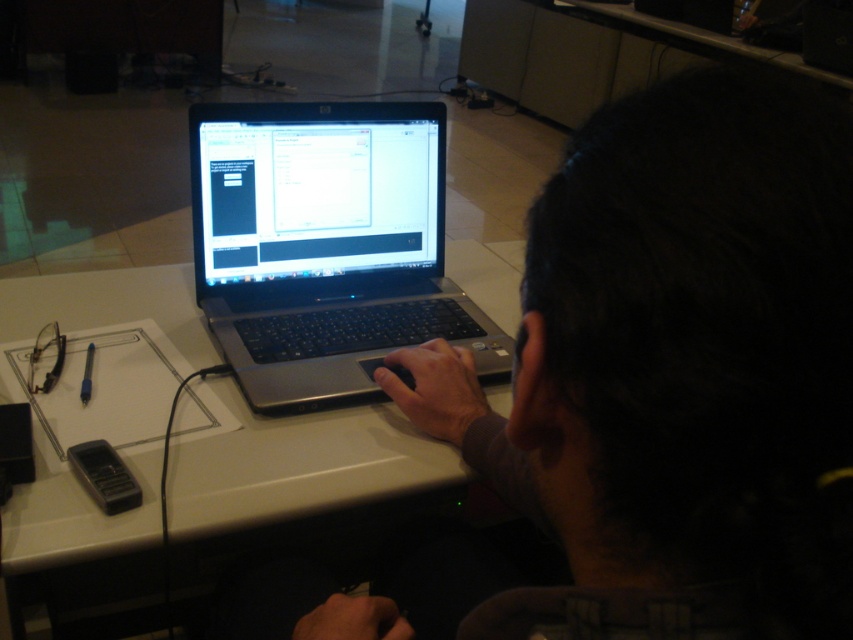
You are organizing a desk and need to place a new item between the dark matte laptop at center and the black plastic phone at lower left. Considering their sizes, which item should be placed closer to the edge of the desk to ensure there is enough space for both?

The black plastic phone at lower left is smaller, so placing it closer to the edge of the desk would leave more space for the larger dark matte laptop at center.

You are a delivery robot that needs to place a small package on the desk. The package is 15 inches long. Can you fit it between the dark matte laptop at center and the white glossy table at center without moving either object?

The distance between the dark matte laptop at center and the white glossy table at center is 14.79 inches. Since the package is 15 inches long, it would not fit in the available space.